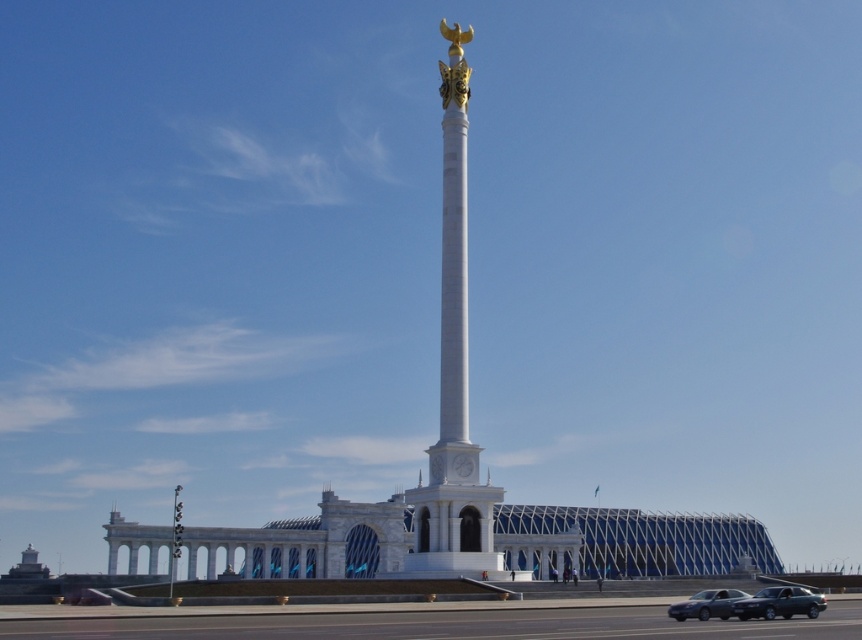
You are a photographer standing at the edge of the plaza. You want to take a photo that includes both the white marble column at center and the silver metallic sedan at lower right. Considering their sizes, which object should you position closer to the camera to ensure both are visible in the frame?

Since the white marble column at center is larger than the silver metallic sedan at lower right, you should position the silver metallic sedan at lower right closer to the camera to balance their apparent sizes in the photo.

You are a photographer planning to capture the monument with both the metallic gray sedan at lower right and the silver metallic sedan at lower right in the frame. Which sedan should you position closer to the monument to ensure both fit in the shot without overlapping?

You should position the silver metallic sedan at lower right closer to the monument since it is narrower than the metallic gray sedan at lower right, allowing both to fit without overlapping.